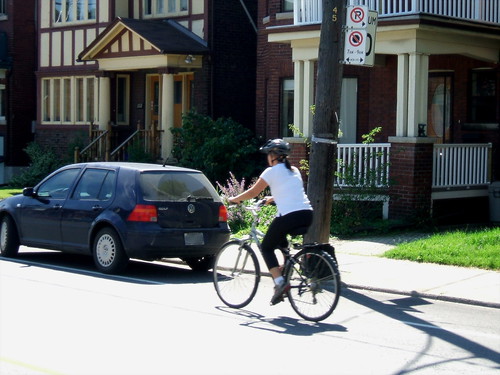
Identify the location of stair rail. The width and height of the screenshot is (500, 375). (99, 138), (125, 144).